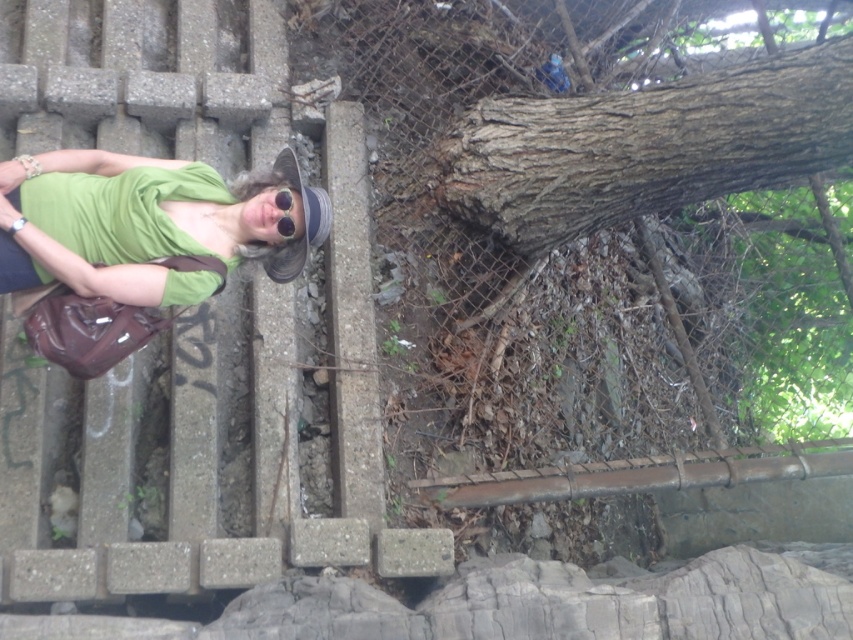
You are a photographer trying to capture a candid shot of the person on the stairs. You are holding a camera and currently standing 3.06 meters away from the green matte shirt at left. Is this distance sufficient to avoid being noticed by the person?

The distance between the camera and the green matte shirt at left is 3.06 meters. Since the person is relaxed and possibly unaware of the photographer, this distance might be sufficient to avoid being noticed, but it ultimately depends on the person being photographed and their awareness of their surroundings.

You are a photographer trying to capture a closeup of the green matte shirt at left and the black matte sunglasses at center. Which object should you focus on first to ensure both are in focus?

The green matte shirt at left is closer to the viewer than the black matte sunglasses at center, so focus on the green matte shirt at left first to ensure both are in focus.